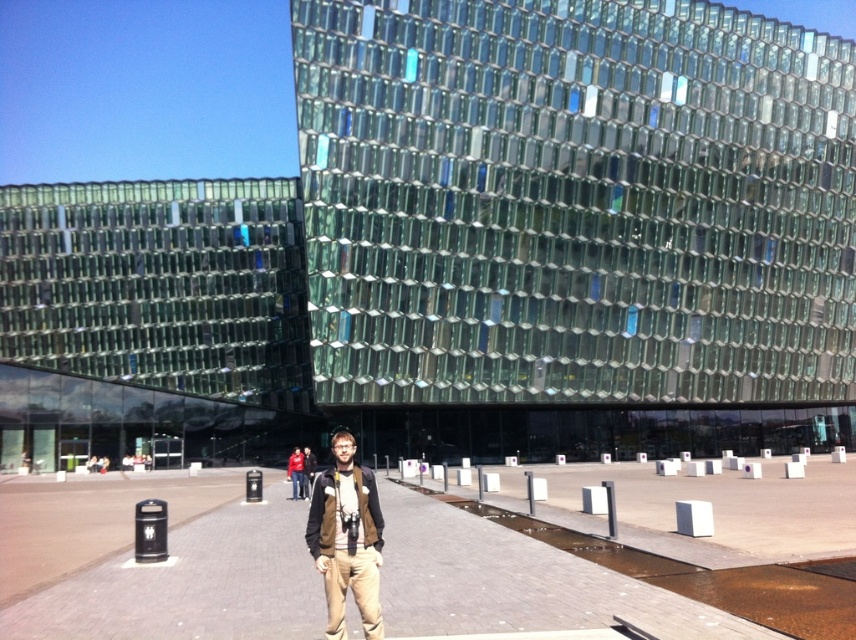
You are a photographer standing in front of the modern architectural structure. You notice the brick pavement at center and the brown leather jacket at center. Which object is taller?

The brown leather jacket at center is taller than the brick pavement at center.

You are taking a photo of the modern building and notice two points marked in the image. The first point is at coordinates point (46, 624) and the second is at point (351, 449). Which point is closer to your camera?

Point (46, 624) is further to the camera than point (351, 449), so the closer point to the camera is point (351, 449).